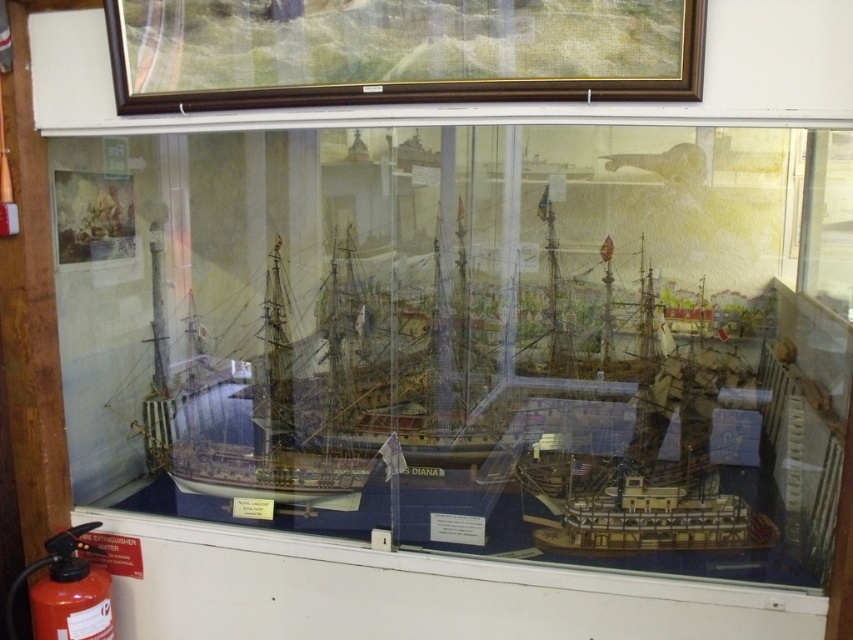
Which of these two, white wooden ship at center or red matte fire extinguisher at lower left, stands taller?

With more height is white wooden ship at center.

Which of these two, white wooden ship at center or red matte fire extinguisher at lower left, stands shorter?

red matte fire extinguisher at lower left

Where is `white wooden ship at center`? This screenshot has width=853, height=640. white wooden ship at center is located at coordinates (247, 422).

Where is `white wooden ship at center`? This screenshot has width=853, height=640. white wooden ship at center is located at coordinates [x=247, y=422].

Is wooden frame at upper center smaller than red matte fire extinguisher at lower left?

Incorrect, wooden frame at upper center is not smaller in size than red matte fire extinguisher at lower left.

Looking at this image, who is more distant from viewer, (300, 48) or (51, 545)?

The point (51, 545) is behind.

What do you see at coordinates (399, 51) in the screenshot?
I see `wooden frame at upper center` at bounding box center [399, 51].

The height and width of the screenshot is (640, 853). I want to click on wooden frame at upper center, so click(x=399, y=51).

Which is in front, point (381, 20) or point (268, 369)?

Positioned in front is point (381, 20).

Is wooden frame at upper center positioned in front of white wooden ship at center?

Yes.

Does point (698, 93) come in front of point (259, 396)?

That is True.

Locate an element on the screen. The width and height of the screenshot is (853, 640). wooden frame at upper center is located at coordinates pos(399,51).